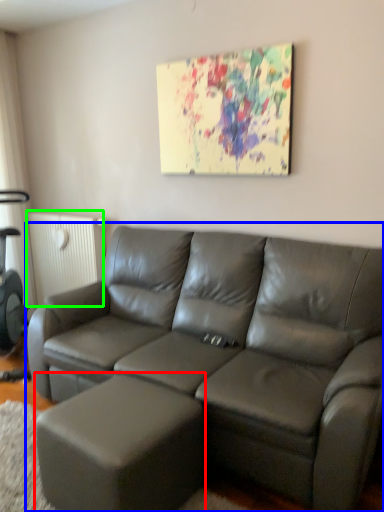
Question: Which object is positioned closest to bar stool (highlighted by a red box)? Select from studio couch (highlighted by a blue box) and radiator (highlighted by a green box).

Choices:
 (A) studio couch
 (B) radiator

Answer: (A)